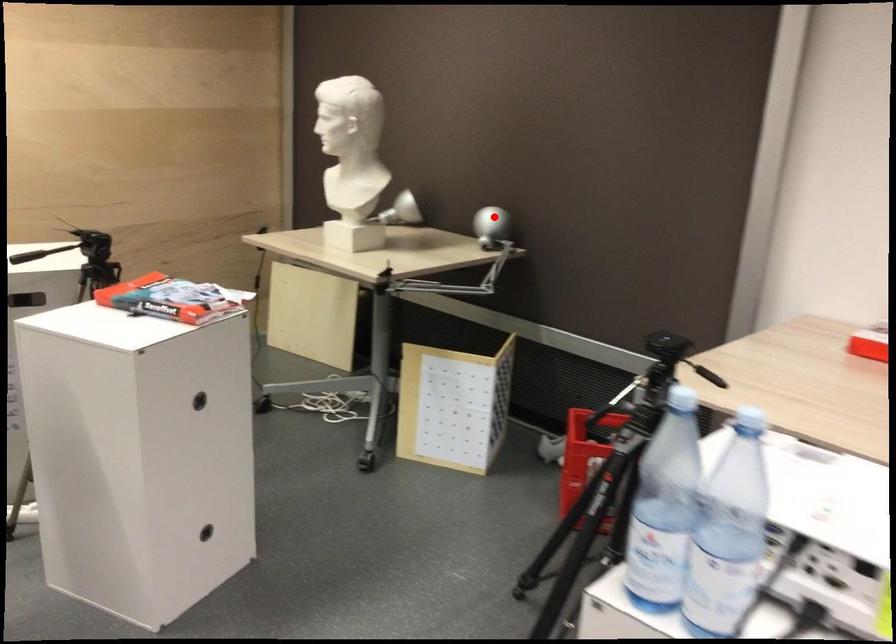
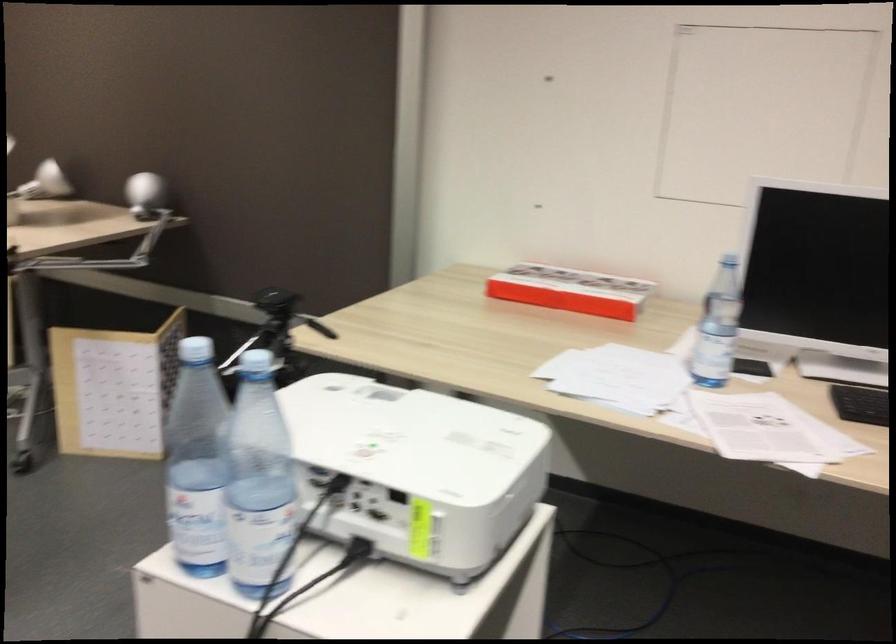
Where in the second image is the point corresponding to the highlighted location from the first image?

(143, 194)